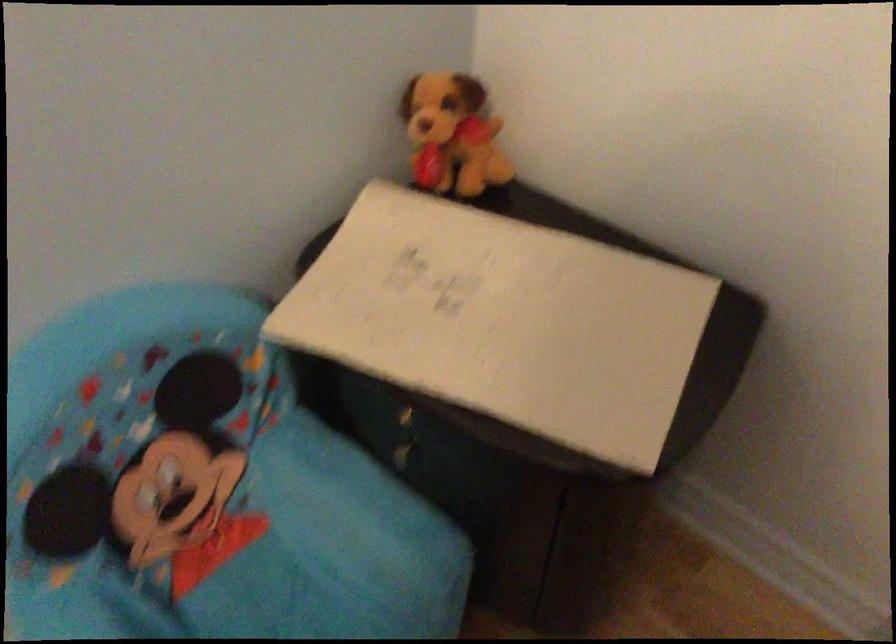
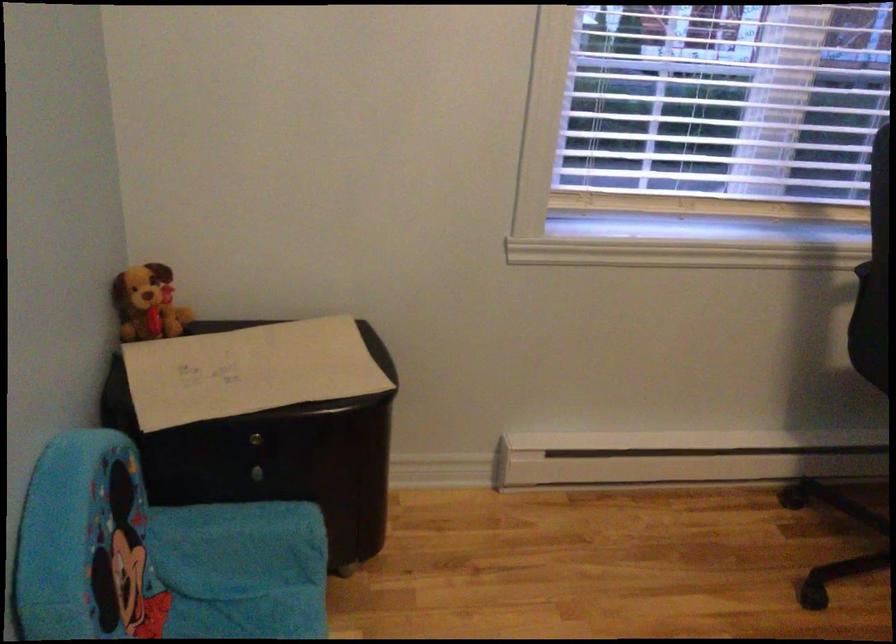
Question: How did the camera likely rotate?

Choices:
 (A) Left
 (B) Right
 (C) Up
 (D) Down

Answer: (B)